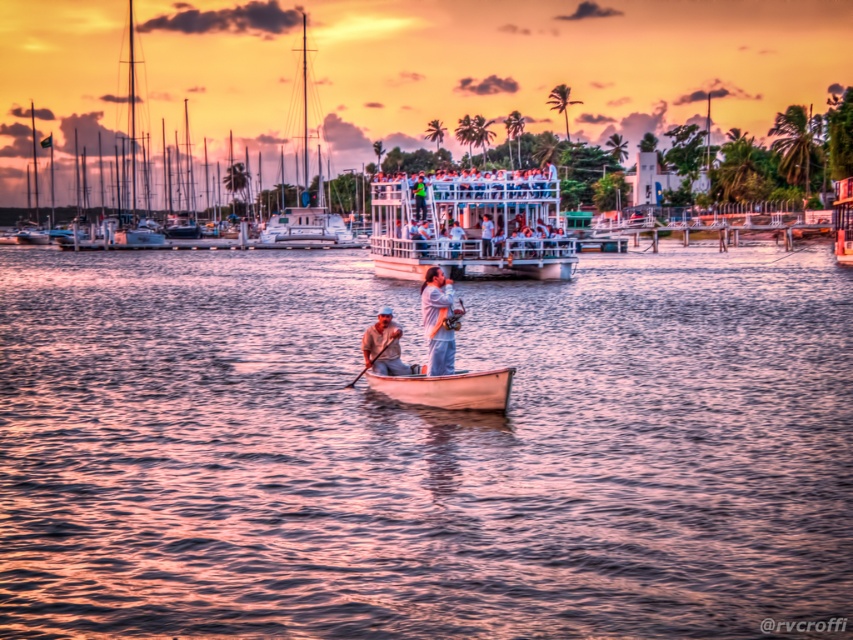
Based on the scene description, where is the light brown wooden boat at center located in terms of its 2D coordinates?

The light brown wooden boat at center is located at the 2D coordinates of point (437,321).

You are planning to take a boat trip on this waterfront. You have two options available to you, the white wooden boat at center and the white metallic boat at center. Which boat would you choose if you want to have more space for your luggage?

The white wooden boat at center has a larger width than the white metallic boat at center, so it can accommodate more luggage.